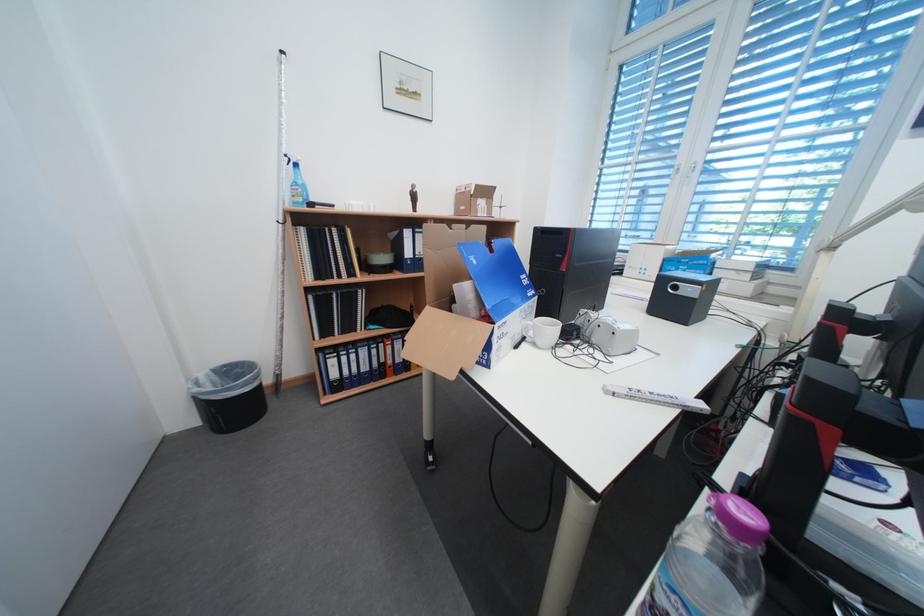
What do you see at coordinates (690, 171) in the screenshot?
I see `a white window handle` at bounding box center [690, 171].